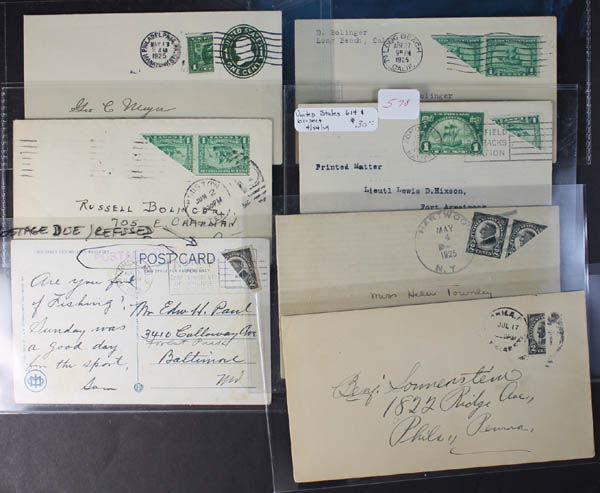
Where is `gray table`? The image size is (600, 493). gray table is located at coordinates (74, 460).